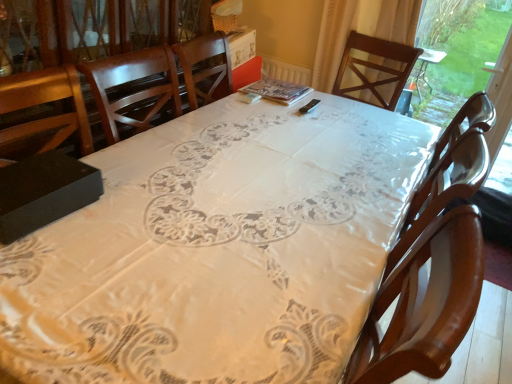
Question: Is wooden chair at center facing towards white lace tablecloth at center?

Choices:
 (A) no
 (B) yes

Answer: (A)

Question: Is wooden chair at center at the right side of white lace tablecloth at center?

Choices:
 (A) no
 (B) yes

Answer: (B)

Question: Is wooden chair at center thinner than white lace tablecloth at center?

Choices:
 (A) yes
 (B) no

Answer: (A)

Question: Considering the relative sizes of wooden chair at center and white lace tablecloth at center in the image provided, is wooden chair at center smaller than white lace tablecloth at center?

Choices:
 (A) no
 (B) yes

Answer: (B)

Question: From a real-world perspective, is wooden chair at center located beneath white lace tablecloth at center?

Choices:
 (A) no
 (B) yes

Answer: (A)

Question: From the image's perspective, would you say wooden chair at center is shown under white lace tablecloth at center?

Choices:
 (A) no
 (B) yes

Answer: (A)

Question: Can you confirm if transparent plastic window screen at right is wider than white lace tablecloth at center?

Choices:
 (A) no
 (B) yes

Answer: (A)

Question: Are transparent plastic window screen at right and white lace tablecloth at center located far from each other?

Choices:
 (A) no
 (B) yes

Answer: (B)

Question: Is transparent plastic window screen at right in front of white lace tablecloth at center?

Choices:
 (A) yes
 (B) no

Answer: (B)

Question: Can you confirm if transparent plastic window screen at right is taller than white lace tablecloth at center?

Choices:
 (A) no
 (B) yes

Answer: (B)

Question: Can white lace tablecloth at center be found inside transparent plastic window screen at right?

Choices:
 (A) no
 (B) yes

Answer: (A)

Question: From a real-world perspective, is transparent plastic window screen at right beneath white lace tablecloth at center?

Choices:
 (A) no
 (B) yes

Answer: (A)

Question: Are white lace tablecloth at center and wooden chair at center making contact?

Choices:
 (A) no
 (B) yes

Answer: (A)